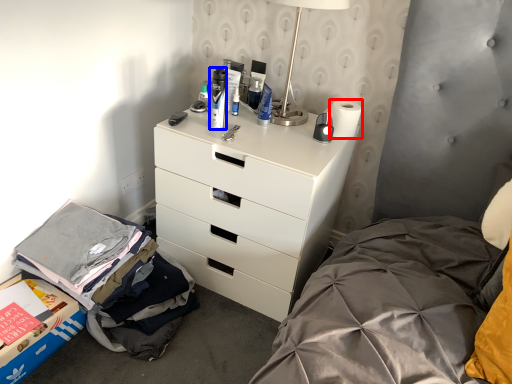
Question: Among these objects, which one is nearest to the camera, toilet paper (highlighted by a red box) or toiletry (highlighted by a blue box)?

Choices:
 (A) toilet paper
 (B) toiletry

Answer: (B)